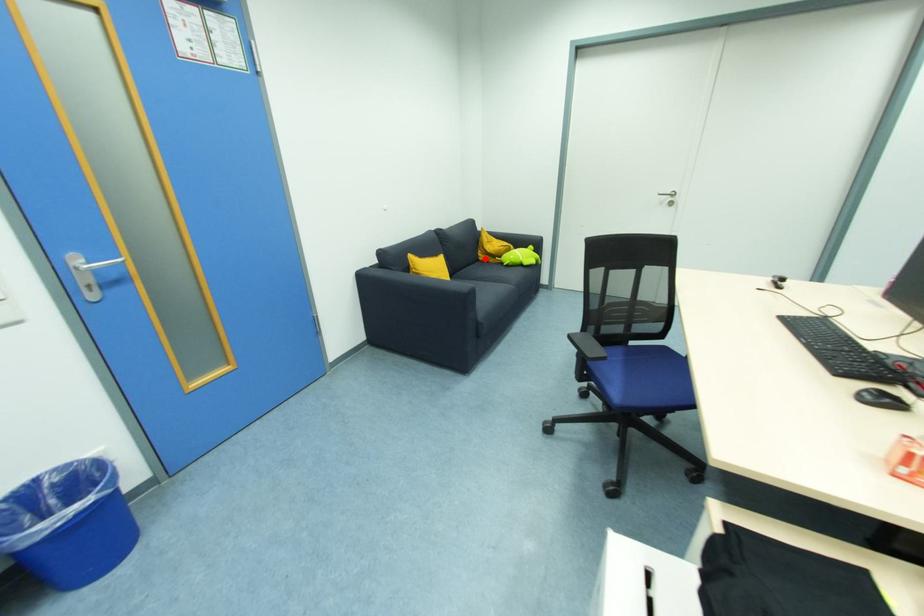
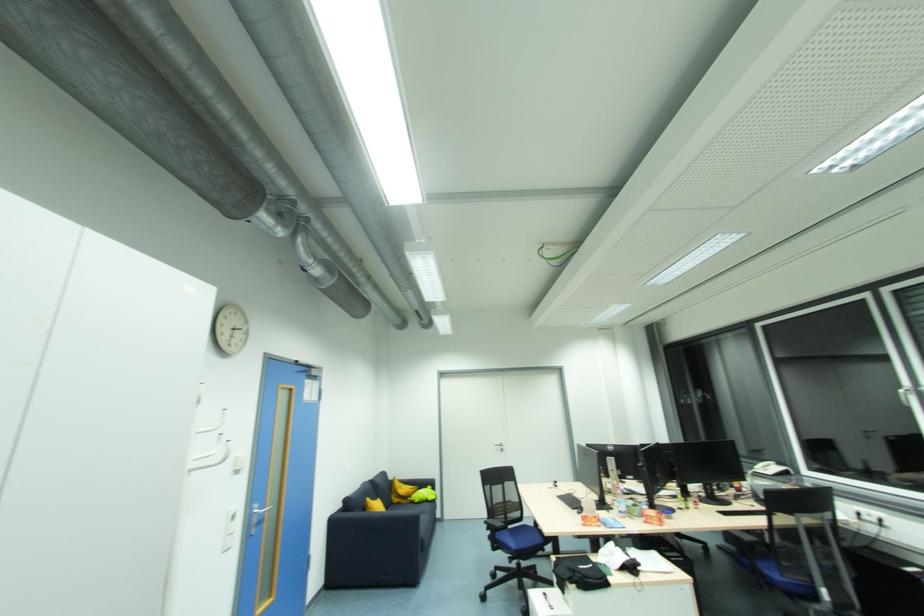
Where in the second image is the point corresponding to the highlighted location from the first image?

(397, 501)